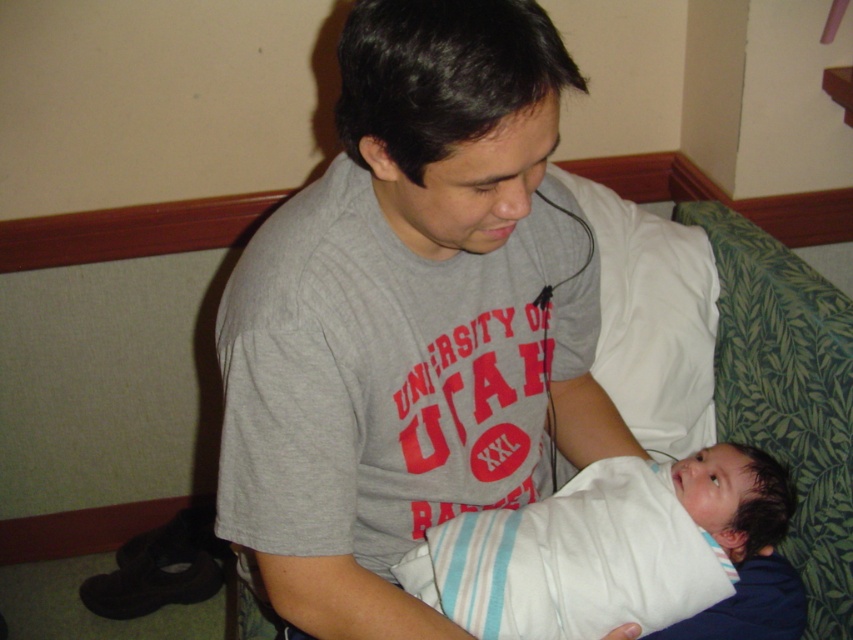
Question: Is gray cotton t-shirt at center bigger than white striped cloth at center?

Choices:
 (A) yes
 (B) no

Answer: (A)

Question: Does gray cotton t-shirt at center have a smaller size compared to white striped cloth at center?

Choices:
 (A) no
 (B) yes

Answer: (A)

Question: Which object appears farthest from the camera in this image?

Choices:
 (A) white striped cloth at center
 (B) gray cotton t-shirt at center

Answer: (A)

Question: Can you confirm if gray cotton t-shirt at center is thinner than white striped cloth at center?

Choices:
 (A) no
 (B) yes

Answer: (B)